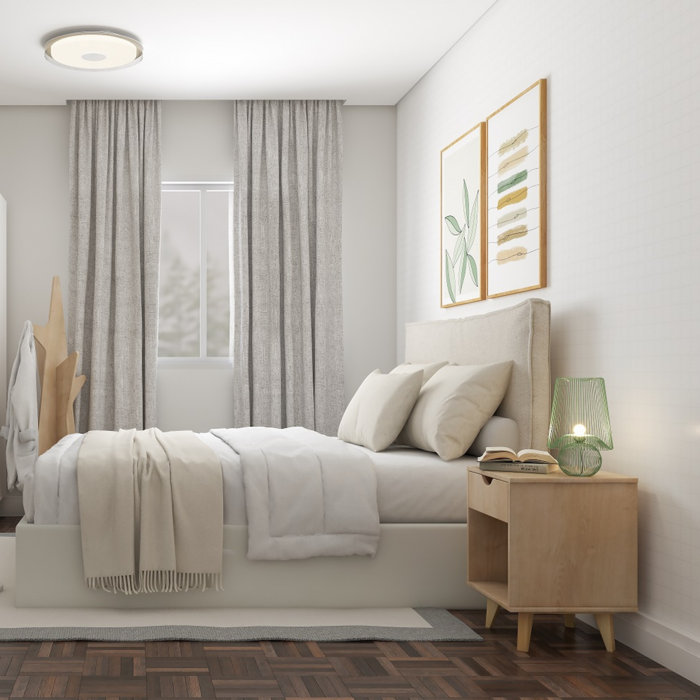
Find the location of a particular element. This screenshot has height=700, width=700. blanket is located at coordinates (103, 586), (169, 582), (206, 577), (197, 514), (190, 439), (141, 439), (99, 437), (94, 511).